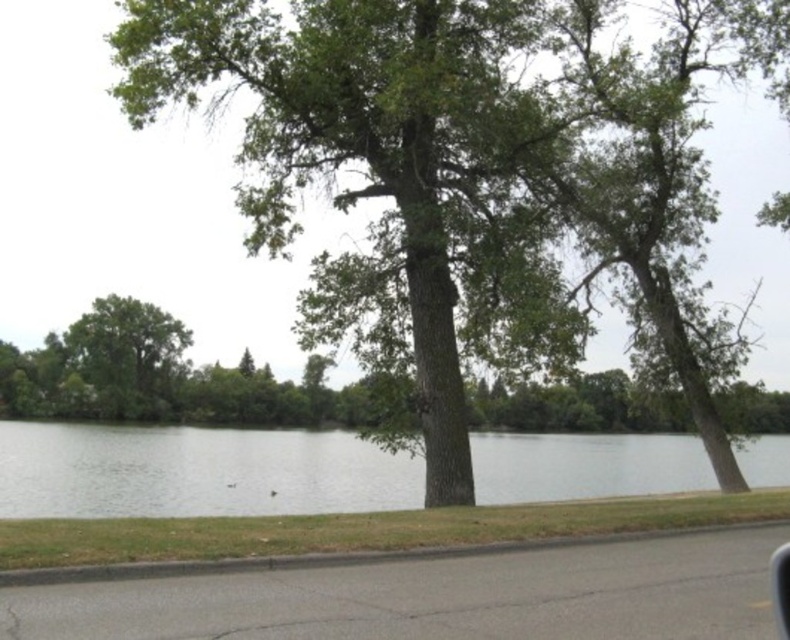
Question: Which point appears closest to the camera in this image?

Choices:
 (A) 172,410
 (B) 298,449

Answer: (B)

Question: Which object is closer to the camera taking this photo?

Choices:
 (A) clear water at center
 (B) green leafy tree at center
 (C) transparent glass car window at lower right

Answer: (C)

Question: Where is green leafy tree at center located in relation to transparent glass car window at lower right in the image?

Choices:
 (A) below
 (B) above

Answer: (B)

Question: Which is farther from the transparent glass car window at lower right?

Choices:
 (A) clear water at center
 (B) green leafy tree at center
 (C) green leafy tree at left

Answer: (C)

Question: Observing the image, what is the correct spatial positioning of green leafy tree at center in reference to clear water at center?

Choices:
 (A) below
 (B) above

Answer: (B)

Question: Does green leafy tree at center appear on the left side of green leafy tree at left?

Choices:
 (A) yes
 (B) no

Answer: (B)